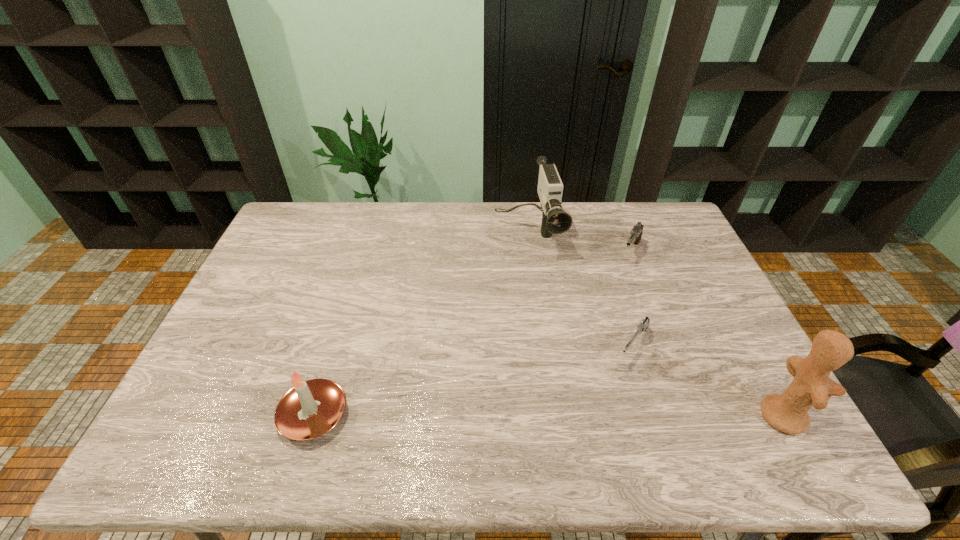
Find the location of a particular element. camcorder positioned at the far edge is located at coordinates (555, 220).

You are a GUI agent. You are given a task and a screenshot of the screen. Output one action in this format:
    pyautogui.click(x=<x>, y=<y>)
    Task: Click on the pistol located at the far edge
    
    Given the screenshot: What is the action you would take?
    pyautogui.click(x=636, y=233)

This screenshot has height=540, width=960. In order to click on candle at the near edge in this screenshot , I will do `click(311, 408)`.

Find the location of a particular element. The image size is (960, 540). figurine at the near edge is located at coordinates (811, 386).

What are the coordinates of `object that is at the right edge` in the screenshot? It's located at (811, 386).

Where is `object that is at the near right corner`? object that is at the near right corner is located at coordinates (811, 386).

In order to click on blank space at the far edge of the desktop in this screenshot , I will do `click(433, 235)`.

This screenshot has height=540, width=960. I want to click on free spot at the near edge of the desktop, so click(x=658, y=392).

Find the location of a particular element. The image size is (960, 540). vacant space at the left edge of the desktop is located at coordinates (247, 328).

Find the location of `free space at the right edge of the desktop`. free space at the right edge of the desktop is located at coordinates (677, 249).